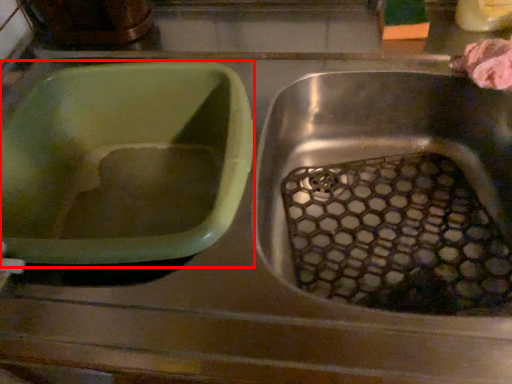
Question: Considering the relative positions of basin (annotated by the red box) and food in the image provided, where is basin (annotated by the red box) located with respect to the staircase?

Choices:
 (A) left
 (B) right

Answer: (A)